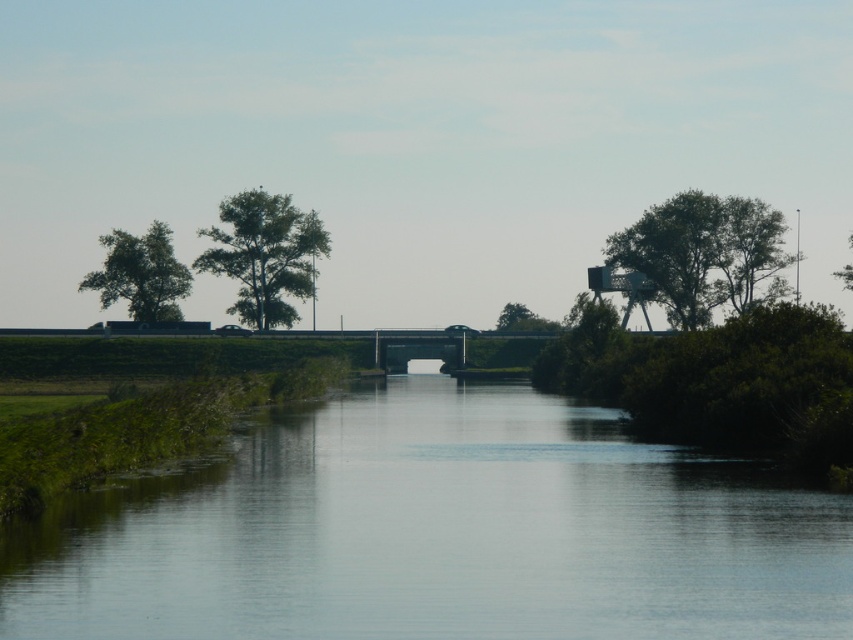
You are a bird flying over the serene rural landscape. You want to land on the tallest tree to rest. Which tree should you choose between the green leafy tree at upper right and the green leafy tree at upper center?

The green leafy tree at upper right is larger in size than the green leafy tree at upper center, so you should choose the green leafy tree at upper right to land on.

You are standing at the edge of the waterway and see the green leafy tree at upper right and the green leafy tree at upper center. Which tree is located to the right of the other?

The green leafy tree at upper right is positioned on the right side of green leafy tree at upper center.